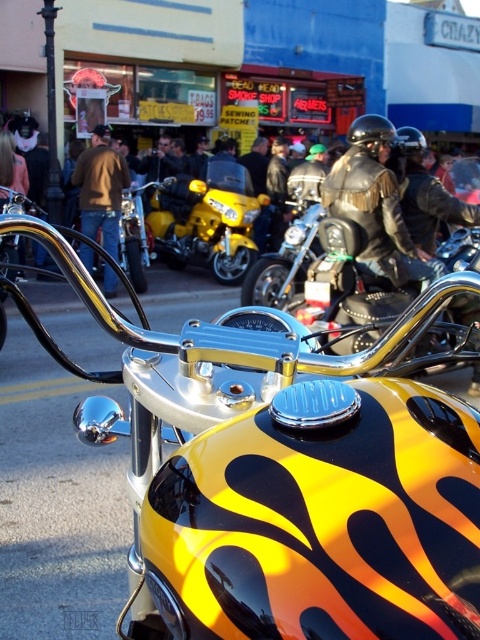
Question: Does shiny chrome motorcycle at center have a smaller size compared to brown leather jacket at center?

Choices:
 (A) no
 (B) yes

Answer: (B)

Question: Estimate the real-world distances between objects in this image. Which object is closer to the flame-painted chrome motorcycle at center?

Choices:
 (A) shiny chrome motorcycle at center
 (B) yellow metallic motorcycle at center
 (C) brown leather jacket at center
 (D) leather jacket at center

Answer: (D)

Question: Is yellow metallic motorcycle at center closer to the viewer compared to leather jacket at center?

Choices:
 (A) no
 (B) yes

Answer: (A)

Question: Based on their relative distances, which object is farther from the yellow metallic motorcycle at center?

Choices:
 (A) brown leather jacket at center
 (B) shiny chrome motorcycle at center
 (C) leather jacket at center
 (D) flame-painted chrome motorcycle at center

Answer: (D)

Question: Is flame-painted chrome motorcycle at center closer to camera compared to brown leather jacket at center?

Choices:
 (A) no
 (B) yes

Answer: (B)

Question: Which is nearer to the shiny chrome motorcycle at center?

Choices:
 (A) flame-painted chrome motorcycle at center
 (B) yellow metallic motorcycle at center
 (C) brown leather jacket at center

Answer: (C)